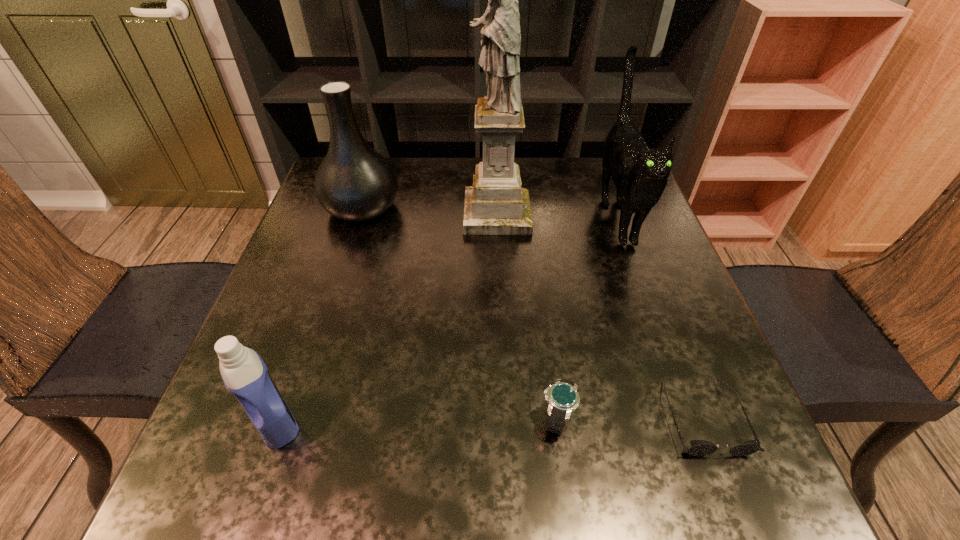
This screenshot has height=540, width=960. I want to click on vacant space at the near left corner, so click(299, 458).

The width and height of the screenshot is (960, 540). What are the coordinates of `vacant region at the far right corner of the desktop` in the screenshot? It's located at (592, 163).

Find the location of a particular element. vacant area that lies between the third shortest object and the shortest object is located at coordinates (490, 418).

I want to click on free spot between the vase and the fourth tallest object, so click(x=319, y=314).

Image resolution: width=960 pixels, height=540 pixels. I want to click on free space between the vase and the tallest object, so click(x=429, y=211).

This screenshot has width=960, height=540. What are the coordinates of `vacant space that is in between the sunglasses and the third shortest object` in the screenshot? It's located at (490, 418).

Where is `free point between the tallest object and the cat`? free point between the tallest object and the cat is located at coordinates (557, 215).

Locate an element on the screen. Image resolution: width=960 pixels, height=540 pixels. empty location between the cat and the watch is located at coordinates [587, 316].

This screenshot has height=540, width=960. I want to click on blank region between the detergent and the vase, so click(x=319, y=314).

Where is `free space between the cat and the shortest object`? free space between the cat and the shortest object is located at coordinates (660, 316).